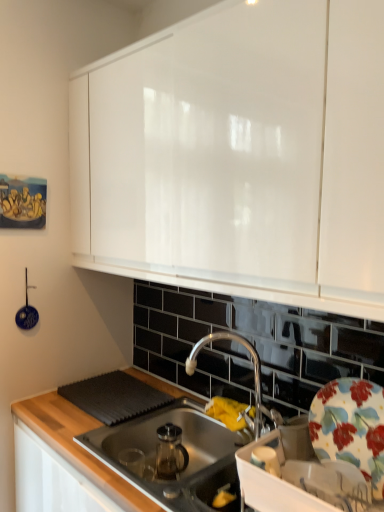
Question: Does stainless steel sink at center lie in front of chrome metallic faucet at center?

Choices:
 (A) yes
 (B) no

Answer: (A)

Question: From a real-world perspective, is stainless steel sink at center on chrome metallic faucet at center?

Choices:
 (A) yes
 (B) no

Answer: (B)

Question: Is the position of stainless steel sink at center more distant than that of chrome metallic faucet at center?

Choices:
 (A) no
 (B) yes

Answer: (A)

Question: Is chrome metallic faucet at center completely or partially inside stainless steel sink at center?

Choices:
 (A) no
 (B) yes

Answer: (A)

Question: Is stainless steel sink at center wider than chrome metallic faucet at center?

Choices:
 (A) no
 (B) yes

Answer: (B)

Question: From the image's perspective, is chrome metallic faucet at center positioned above or below stainless steel sink at center?

Choices:
 (A) below
 (B) above

Answer: (B)

Question: Considering the positions of chrome metallic faucet at center and stainless steel sink at center in the image, is chrome metallic faucet at center taller or shorter than stainless steel sink at center?

Choices:
 (A) tall
 (B) short

Answer: (A)

Question: Do you think chrome metallic faucet at center is within stainless steel sink at center, or outside of it?

Choices:
 (A) inside
 (B) outside

Answer: (B)

Question: Looking at the image, does chrome metallic faucet at center seem bigger or smaller compared to stainless steel sink at center?

Choices:
 (A) small
 (B) big

Answer: (A)

Question: Is point (344, 398) closer or farther from the camera than point (115, 439)?

Choices:
 (A) closer
 (B) farther

Answer: (A)

Question: From the image's perspective, is floral ceramic plate at right located above or below stainless steel sink at center?

Choices:
 (A) below
 (B) above

Answer: (B)

Question: Is floral ceramic plate at right spatially inside stainless steel sink at center, or outside of it?

Choices:
 (A) inside
 (B) outside

Answer: (B)

Question: Considering the relative positions of floral ceramic plate at right and stainless steel sink at center in the image provided, is floral ceramic plate at right to the left or to the right of stainless steel sink at center?

Choices:
 (A) left
 (B) right

Answer: (B)

Question: Considering the positions of blue ceramic ladle at left and chrome metallic faucet at center in the image, is blue ceramic ladle at left bigger or smaller than chrome metallic faucet at center?

Choices:
 (A) big
 (B) small

Answer: (B)

Question: Which is correct: blue ceramic ladle at left is inside chrome metallic faucet at center, or outside of it?

Choices:
 (A) inside
 (B) outside

Answer: (B)